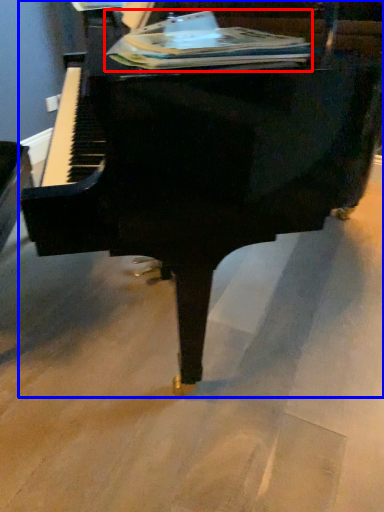
Question: Which point is closer to the camera, paperback book (highlighted by a red box) or piano (highlighted by a blue box)?

Choices:
 (A) paperback book
 (B) piano

Answer: (B)